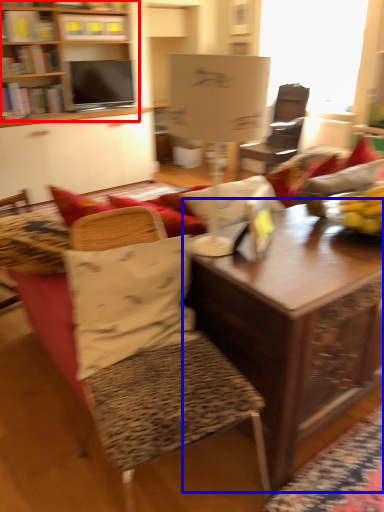
Question: Which object is further to the camera taking this photo, bookcase (highlighted by a red box) or table (highlighted by a blue box)?

Choices:
 (A) bookcase
 (B) table

Answer: (A)